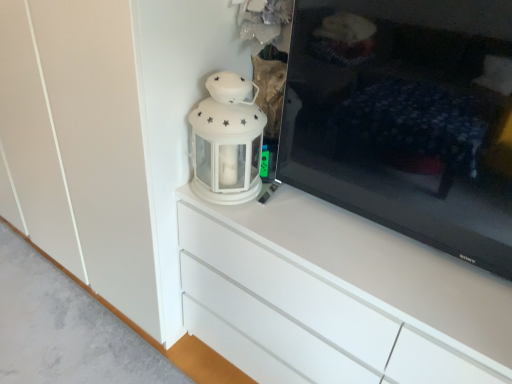
Describe the element at coordinates (335, 297) in the screenshot. I see `white glossy chest of drawers at center` at that location.

Identify the location of white glossy chest of drawers at center. This screenshot has width=512, height=384. (335, 297).

Would you say black glossy tv at right is inside or outside white glossy lantern at upper center?

black glossy tv at right is outside white glossy lantern at upper center.

Would you say black glossy tv at right is a long distance from white glossy lantern at upper center?

They are positioned close to each other.

Locate an element on the screen. lantern below the black glossy tv at right (from a real-world perspective) is located at coordinates (227, 141).

From a real-world perspective, who is located higher, black glossy tv at right or white glossy lantern at upper center?

In real-world perspective, black glossy tv at right is above.

Is black glossy tv at right wider than white glossy chest of drawers at center?

No.

Is white glossy chest of drawers at center surrounded by black glossy tv at right?

No.

How different are the orientations of black glossy tv at right and white glossy chest of drawers at center in degrees?

The angle between the facing direction of black glossy tv at right and the facing direction of white glossy chest of drawers at center is 0.00231 degrees.

Consider the image. From a real-world perspective, which is physically below, black glossy tv at right or white glossy chest of drawers at center?

From a 3D spatial view, white glossy chest of drawers at center is below.

Is point (194, 134) behind point (340, 19)?

Yes, it is.

Is black glossy tv at right completely or partially inside white glossy lantern at upper center?

No, black glossy tv at right is not surrounded by white glossy lantern at upper center.

From the image's perspective, relative to black glossy tv at right, is white glossy lantern at upper center above or below?

Clearly, from the image's perspective, white glossy lantern at upper center is above black glossy tv at right.

From a real-world perspective, is white glossy lantern at upper center positioned over black glossy tv at right based on gravity?

No, from a real-world perspective, white glossy lantern at upper center is not over black glossy tv at right

Is white glossy lantern at upper center with white glossy chest of drawers at center?

No, white glossy lantern at upper center is not making contact with white glossy chest of drawers at center.

Considering the relative sizes of white glossy lantern at upper center and white glossy chest of drawers at center in the image provided, is white glossy lantern at upper center bigger than white glossy chest of drawers at center?

Incorrect, white glossy lantern at upper center is not larger than white glossy chest of drawers at center.

From a real-world perspective, relative to white glossy chest of drawers at center, is white glossy lantern at upper center vertically above or below?

white glossy lantern at upper center is above white glossy chest of drawers at center.

Which is in front, point (248, 102) or point (195, 299)?

Positioned in front is point (248, 102).

Is white glossy chest of drawers at center inside or outside of black glossy tv at right?

white glossy chest of drawers at center is located beyond the bounds of black glossy tv at right.

Considering the sizes of white glossy chest of drawers at center and black glossy tv at right in the image, is white glossy chest of drawers at center taller or shorter than black glossy tv at right?

white glossy chest of drawers at center is taller than black glossy tv at right.

Is there a large distance between white glossy chest of drawers at center and black glossy tv at right?

No, white glossy chest of drawers at center is in close proximity to black glossy tv at right.

How far apart are white glossy chest of drawers at center and white glossy lantern at upper center?

white glossy chest of drawers at center and white glossy lantern at upper center are 12.48 inches apart from each other.

From a real-world perspective, is white glossy chest of drawers at center located higher than white glossy lantern at upper center?

No, from a real-world perspective, white glossy chest of drawers at center is not above white glossy lantern at upper center.

Choose the correct answer: Is white glossy chest of drawers at center inside white glossy lantern at upper center or outside it?

white glossy chest of drawers at center is located beyond the bounds of white glossy lantern at upper center.

Is white glossy chest of drawers at center not close to white glossy lantern at upper center?

white glossy chest of drawers at center is near white glossy lantern at upper center, not far away.

The height and width of the screenshot is (384, 512). Identify the location of lantern lying behind the black glossy tv at right. (227, 141).

Image resolution: width=512 pixels, height=384 pixels. I want to click on chest of drawers lying on the left of black glossy tv at right, so click(335, 297).

Which object lies nearer to the anchor point white glossy chest of drawers at center, white glossy lantern at upper center or black glossy tv at right?

Result: white glossy lantern at upper center lies closer to white glossy chest of drawers at center than the other object.

In the scene shown: Looking at the image, which one is located further to black glossy tv at right, white glossy chest of drawers at center or white glossy lantern at upper center?

white glossy lantern at upper center is further to black glossy tv at right.

Which object lies nearer to the anchor point white glossy lantern at upper center, white glossy chest of drawers at center or black glossy tv at right?

white glossy chest of drawers at center is closer to white glossy lantern at upper center.

Which object lies nearer to the anchor point black glossy tv at right, white glossy lantern at upper center or white glossy chest of drawers at center?

The object closer to black glossy tv at right is white glossy chest of drawers at center.

Looking at this image, looking at the image, which one is located further to white glossy lantern at upper center, black glossy tv at right or white glossy chest of drawers at center?

Based on the image, black glossy tv at right appears to be further to white glossy lantern at upper center.

Based on their spatial positions, is black glossy tv at right or white glossy lantern at upper center further from white glossy chest of drawers at center?

black glossy tv at right is further to white glossy chest of drawers at center.

Locate an element on the screen. The image size is (512, 384). television between white glossy lantern at upper center and white glossy chest of drawers at center in the vertical direction is located at coordinates (405, 119).